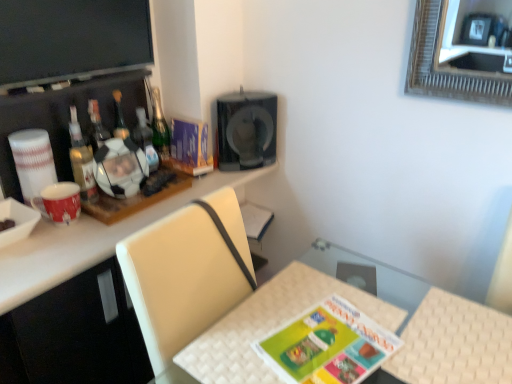
Question: Does matte purple magazine at upper center have a greater width compared to white woven table at lower center?

Choices:
 (A) yes
 (B) no

Answer: (B)

Question: From a real-world perspective, is matte purple magazine at upper center physically above white woven table at lower center?

Choices:
 (A) no
 (B) yes

Answer: (B)

Question: Could you tell me if matte purple magazine at upper center is facing white woven table at lower center?

Choices:
 (A) yes
 (B) no

Answer: (B)

Question: Does matte purple magazine at upper center have a lesser height compared to white woven table at lower center?

Choices:
 (A) no
 (B) yes

Answer: (A)

Question: Can you confirm if matte purple magazine at upper center is smaller than white woven table at lower center?

Choices:
 (A) no
 (B) yes

Answer: (B)

Question: From a real-world perspective, relative to translucent glass bottle at left, which is the first bottle from left to right, is flat matte screen at upper left vertically above or below?

Choices:
 (A) below
 (B) above

Answer: (B)

Question: From their relative heights in the image, would you say flat matte screen at upper left is taller or shorter than translucent glass bottle at left, which is the first bottle from left to right?

Choices:
 (A) short
 (B) tall

Answer: (A)

Question: Considering the positions of flat matte screen at upper left and translucent glass bottle at left, the 4th bottle when ordered from right to left, in the image, is flat matte screen at upper left bigger or smaller than translucent glass bottle at left, the 4th bottle when ordered from right to left,?

Choices:
 (A) big
 (B) small

Answer: (A)

Question: Is flat matte screen at upper left in front of or behind translucent glass bottle at left, the 4th bottle when ordered from right to left, in the image?

Choices:
 (A) behind
 (B) front

Answer: (B)

Question: Would you say flat matte screen at upper left is inside or outside white woven table at lower center?

Choices:
 (A) inside
 (B) outside

Answer: (B)

Question: Considering the relative positions of flat matte screen at upper left and white woven table at lower center in the image provided, is flat matte screen at upper left to the left or to the right of white woven table at lower center?

Choices:
 (A) left
 (B) right

Answer: (A)

Question: Looking at the image, does flat matte screen at upper left seem bigger or smaller compared to white woven table at lower center?

Choices:
 (A) small
 (B) big

Answer: (B)

Question: Is point (140, 66) positioned closer to the camera than point (417, 374)?

Choices:
 (A) farther
 (B) closer

Answer: (A)

Question: From their relative heights in the image, would you say matte green board game at center is taller or shorter than translucent glass bottle at left, the 4th bottle when ordered from right to left?

Choices:
 (A) tall
 (B) short

Answer: (B)

Question: Is point (328, 337) positioned closer to the camera than point (77, 182)?

Choices:
 (A) closer
 (B) farther

Answer: (A)